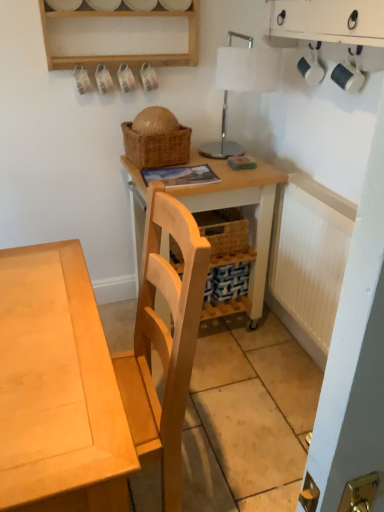
I want to click on free space above wooden table at center (from a real-world perspective), so click(x=181, y=170).